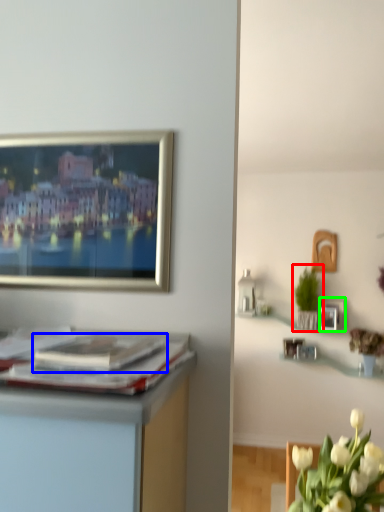
Question: Which is farther away from houseplant (highlighted by a red box)? magazine (highlighted by a blue box) or picture frame (highlighted by a green box)?

Choices:
 (A) magazine
 (B) picture frame

Answer: (A)